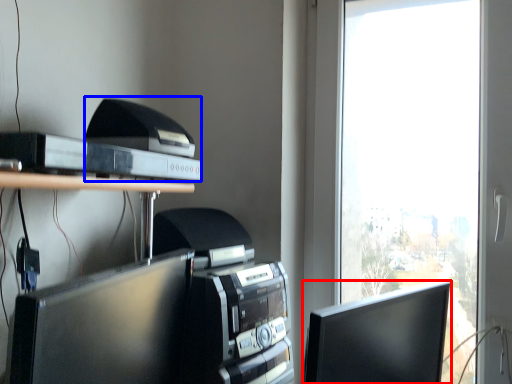
Question: Which of the following is the closest to the observer, computer monitor (highlighted by a red box) or printer (highlighted by a blue box)?

Choices:
 (A) computer monitor
 (B) printer

Answer: (A)